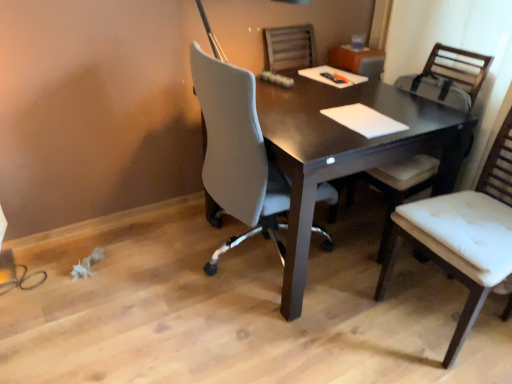
The image size is (512, 384). What do you see at coordinates (464, 234) in the screenshot?
I see `white leather chair at right, arranged as the second chair when viewed from the back` at bounding box center [464, 234].

Locate an element on the screen. white fabric chair at right, positioned as the 2th chair in front-to-back order is located at coordinates (451, 75).

The image size is (512, 384). I want to click on dark wood desk at center, so click(x=346, y=151).

Is white leather chair at right, which is the 1th chair in front-to-back order, positioned before dark wood desk at center?

Yes, it is.

What's the angular difference between white leather chair at right, arranged as the second chair when viewed from the back, and dark wood desk at center's facing directions?

The angular difference between white leather chair at right, arranged as the second chair when viewed from the back, and dark wood desk at center is 93.1 degrees.

Considering the relative sizes of white leather chair at right, which is the 1th chair in front-to-back order, and dark wood desk at center in the image provided, is white leather chair at right, which is the 1th chair in front-to-back order, thinner than dark wood desk at center?

Yes.

From a real-world perspective, relative to dark wood desk at center, is white leather chair at right, arranged as the second chair when viewed from the back, vertically above or below?

white leather chair at right, arranged as the second chair when viewed from the back, is above dark wood desk at center.

In terms of size, does white fabric chair at right, positioned as the 2th chair in front-to-back order, appear bigger or smaller than white leather chair at right, arranged as the second chair when viewed from the back?

white fabric chair at right, positioned as the 2th chair in front-to-back order, is bigger than white leather chair at right, arranged as the second chair when viewed from the back.

Is white fabric chair at right, which is the 1th chair from back to front, directly adjacent to white leather chair at right, which is the 1th chair in front-to-back order?

No, white fabric chair at right, which is the 1th chair from back to front, is not with white leather chair at right, which is the 1th chair in front-to-back order.

Which is less distant, [393,173] or [440,245]?

Positioned in front is point [440,245].

Is white fabric chair at right, positioned as the 2th chair in front-to-back order, turned away from white leather chair at right, arranged as the second chair when viewed from the back?

No, white fabric chair at right, positioned as the 2th chair in front-to-back order, is not facing the opposite direction of white leather chair at right, arranged as the second chair when viewed from the back.

Is white fabric chair at right, positioned as the 2th chair in front-to-back order, not near dark wood desk at center?

Actually, white fabric chair at right, positioned as the 2th chair in front-to-back order, and dark wood desk at center are a little close together.

Considering the sizes of white fabric chair at right, positioned as the 2th chair in front-to-back order, and dark wood desk at center in the image, is white fabric chair at right, positioned as the 2th chair in front-to-back order, wider or thinner than dark wood desk at center?

Clearly, white fabric chair at right, positioned as the 2th chair in front-to-back order, has less width compared to dark wood desk at center.

Which is in front, white fabric chair at right, which is the 1th chair from back to front, or dark wood desk at center?

dark wood desk at center.

Does point (393, 205) come in front of point (280, 89)?

Yes, it is in front of point (280, 89).

Looking at this image, is dark wood desk at center taller or shorter than white fabric chair at right, which is the 1th chair from back to front?

dark wood desk at center is shorter than white fabric chair at right, which is the 1th chair from back to front.

Considering the sizes of objects dark wood desk at center and white fabric chair at right, which is the 1th chair from back to front, in the image provided, who is wider, dark wood desk at center or white fabric chair at right, which is the 1th chair from back to front,?

Wider between the two is dark wood desk at center.

Is dark wood desk at center positioned far away from white fabric chair at right, positioned as the 2th chair in front-to-back order?

No, dark wood desk at center is not far from white fabric chair at right, positioned as the 2th chair in front-to-back order.

Does point (319, 134) lie behind point (450, 78)?

No.

Find the location of a particular element. desk lying behind the white leather chair at right, arranged as the second chair when viewed from the back is located at coordinates (346, 151).

Could you tell me if dark wood desk at center is turned towards white leather chair at right, which is the 1th chair in front-to-back order?

Yes.

Is dark wood desk at center touching white leather chair at right, which is the 1th chair in front-to-back order?

dark wood desk at center and white leather chair at right, which is the 1th chair in front-to-back order, are not in contact.

How much distance is there between white leather chair at right, which is the 1th chair in front-to-back order, and white fabric chair at right, positioned as the 2th chair in front-to-back order?

white leather chair at right, which is the 1th chair in front-to-back order, is 12.63 inches away from white fabric chair at right, positioned as the 2th chair in front-to-back order.

Considering the positions of points (461, 319) and (376, 182), is point (461, 319) farther from camera compared to point (376, 182)?

No, (461, 319) is in front of (376, 182).

Where is `chair located in front of the white fabric chair at right, which is the 1th chair from back to front`? The width and height of the screenshot is (512, 384). chair located in front of the white fabric chair at right, which is the 1th chair from back to front is located at coordinates (464, 234).

This screenshot has width=512, height=384. I want to click on the 2nd chair counting from the right side of the dark wood desk at center, so click(x=464, y=234).

Where is `chair below the white leather chair at right, which is the 1th chair in front-to-back order (from a real-world perspective)`? This screenshot has width=512, height=384. chair below the white leather chair at right, which is the 1th chair in front-to-back order (from a real-world perspective) is located at coordinates (451, 75).

From the image, which object appears to be nearer to white leather chair at right, arranged as the second chair when viewed from the back, dark wood desk at center or white fabric chair at right, positioned as the 2th chair in front-to-back order?

Among the two, white fabric chair at right, positioned as the 2th chair in front-to-back order, is located nearer to white leather chair at right, arranged as the second chair when viewed from the back.

Looking at this image, from the image, which object appears to be farther from dark wood desk at center, white fabric chair at right, which is the 1th chair from back to front, or white leather chair at right, which is the 1th chair in front-to-back order?

Based on the image, white leather chair at right, which is the 1th chair in front-to-back order, appears to be further to dark wood desk at center.

When comparing their distances from white fabric chair at right, positioned as the 2th chair in front-to-back order, does white leather chair at right, arranged as the second chair when viewed from the back, or dark wood desk at center seem closer?

Based on the image, dark wood desk at center appears to be nearer to white fabric chair at right, positioned as the 2th chair in front-to-back order.

Estimate the real-world distances between objects in this image. Which object is further from white fabric chair at right, positioned as the 2th chair in front-to-back order, dark wood desk at center or white leather chair at right, which is the 1th chair in front-to-back order?

white leather chair at right, which is the 1th chair in front-to-back order, lies further to white fabric chair at right, positioned as the 2th chair in front-to-back order, than the other object.

Based on their spatial positions, is white leather chair at right, which is the 1th chair in front-to-back order, or white fabric chair at right, positioned as the 2th chair in front-to-back order, closer to dark wood desk at center?

white fabric chair at right, positioned as the 2th chair in front-to-back order, lies closer to dark wood desk at center than the other object.

Considering their positions, is white fabric chair at right, positioned as the 2th chair in front-to-back order, positioned further to white leather chair at right, arranged as the second chair when viewed from the back, than dark wood desk at center?

Among the two, dark wood desk at center is located further to white leather chair at right, arranged as the second chair when viewed from the back.

This screenshot has width=512, height=384. Identify the location of chair located between dark wood desk at center and white leather chair at right, arranged as the second chair when viewed from the back, in the left-right direction. (451, 75).